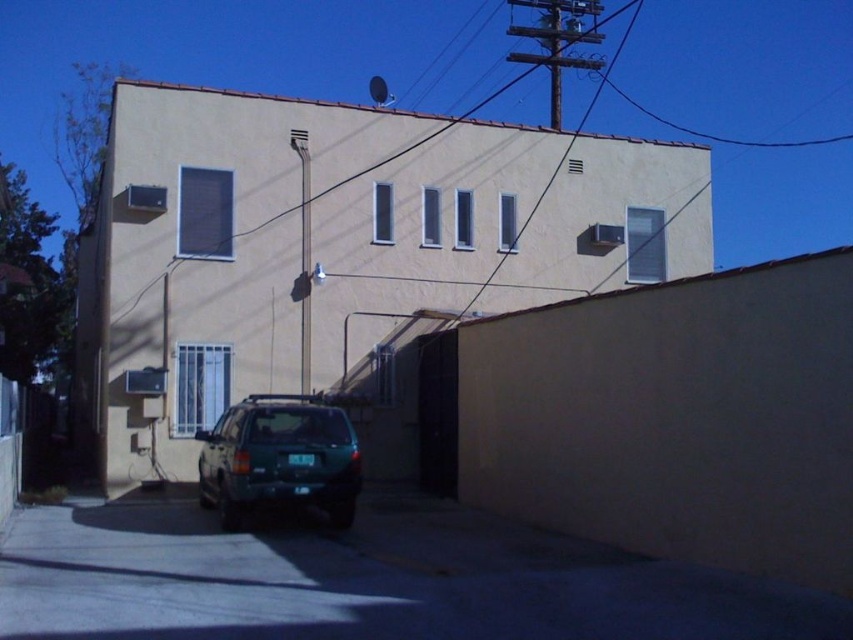
You are standing 50 feet away from the residential building. You want to reach the point marked at coordinates point (370,516). Can you walk straight towards the building from your current position and reach that point without moving sideways?

The distance of point (370,516) from viewer is 47.21 feet. Since you are currently 50 feet away, you can walk straight towards the building and reach the point without needing to move sideways as the distance is sufficient.

You are a delivery person trying to park your truck in the driveway. The truck is 2 meters wide. Can you fit your truck on the dark gray asphalt at lower center if the brown wire at upper center is 3 meters above the ground?

The dark gray asphalt at lower center has a width less than the brown wire at upper center. Since the brown wire at upper center is 3 meters above the ground, the asphalt width is less than 3 meters. Therefore, the truck which is 2 meters wide can fit on the dark gray asphalt at lower center as long as the width is sufficient. However, the exact width of the asphalt is not provided, so it depends on whether the asphalt is wider than 2 meters.